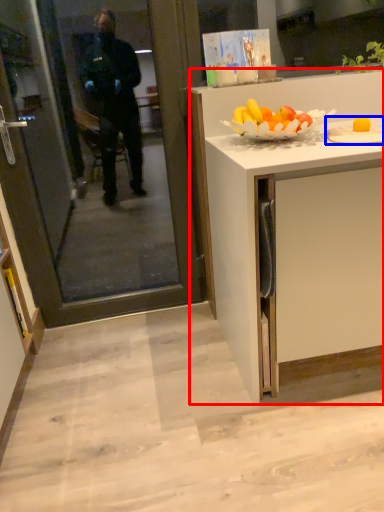
Question: Which object is further to the camera taking this photo, cabinetry (highlighted by a red box) or plate (highlighted by a blue box)?

Choices:
 (A) cabinetry
 (B) plate

Answer: (B)